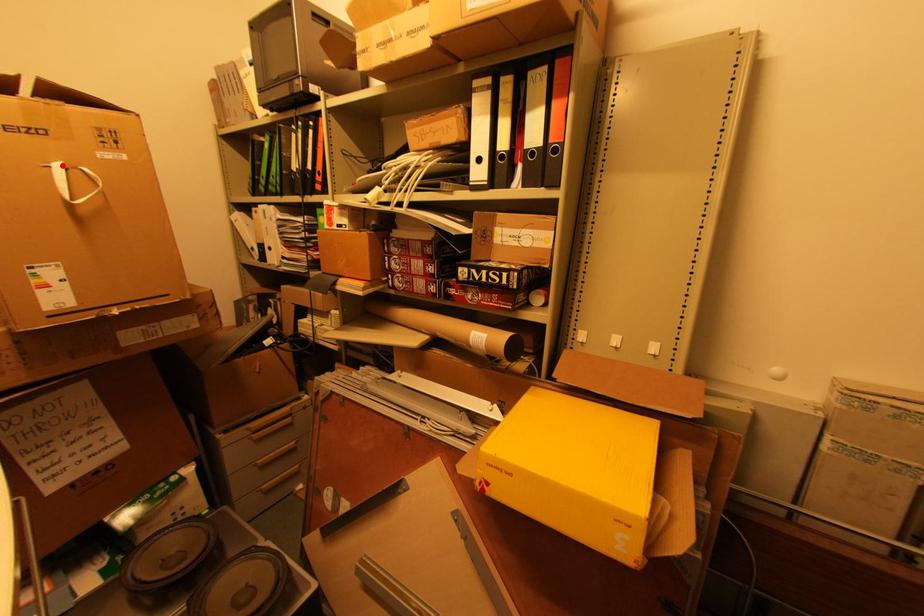
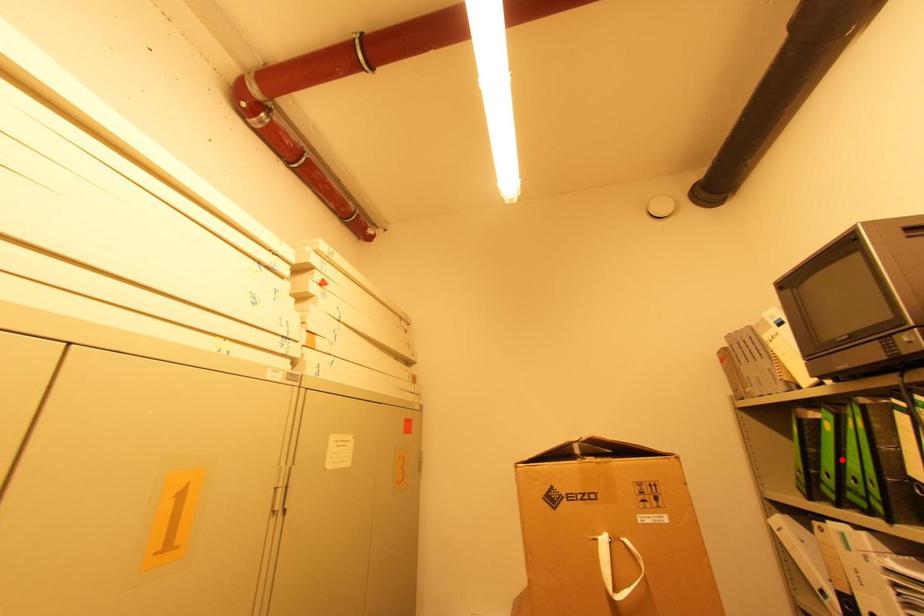
I am providing you with two images of the same scene from different viewpoints. A red point is marked on the first image and another point is marked on the second image. Is the marked point in image1 the same physical position as the marked point in image2?

No